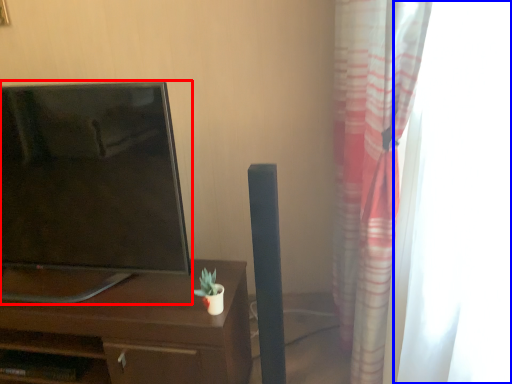
Question: Which object appears farthest to the camera in this image, television (highlighted by a red box) or glass door (highlighted by a blue box)?

Choices:
 (A) television
 (B) glass door

Answer: (A)